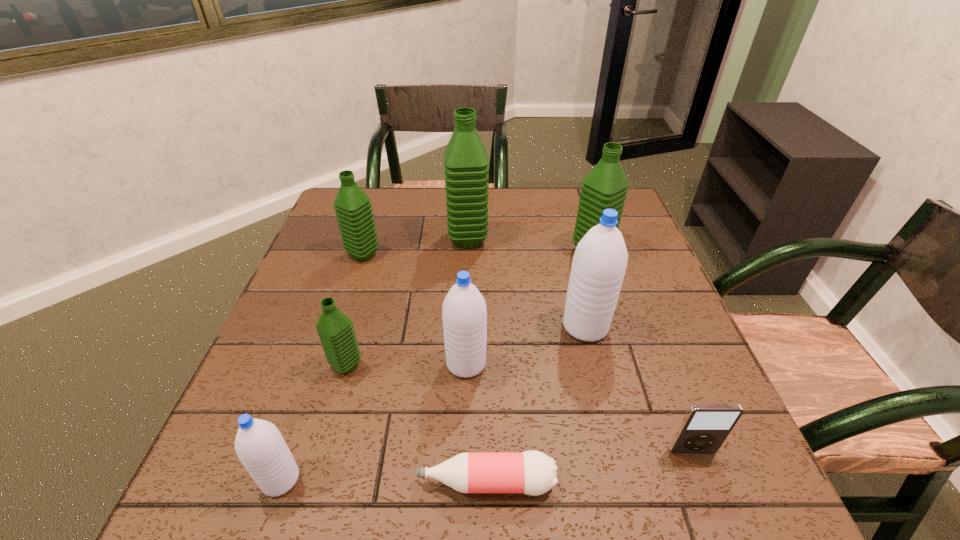
Where is `vacant space situated 0.310m on the back of the smallest green water bottle`? The image size is (960, 540). vacant space situated 0.310m on the back of the smallest green water bottle is located at coordinates (376, 260).

Locate an element on the screen. vacant space located on the back of the smallest blue water bottle is located at coordinates (324, 351).

This screenshot has height=540, width=960. What are the coordinates of `blank space located 0.100m on the front-facing side of the iPod` in the screenshot? It's located at (717, 516).

Locate an element on the screen. This screenshot has width=960, height=540. free location located with the cap open on the pink bottle is located at coordinates [x=308, y=482].

Where is `free space located 0.180m with the cap open on the pink bottle`? free space located 0.180m with the cap open on the pink bottle is located at coordinates (308, 482).

Identify the location of vacant position located with the cap open on the pink bottle. (333, 482).

The image size is (960, 540). Find the location of `object that is at the far edge`. object that is at the far edge is located at coordinates (466, 162).

Find the location of a particular element. The image size is (960, 540). water bottle present at the near edge is located at coordinates (260, 447).

You are a GUI agent. You are given a task and a screenshot of the screen. Output one action in this format:
    pyautogui.click(x=<x>, y=<y>)
    Task: Click on the bottle present at the near edge
    This screenshot has height=540, width=960.
    Given the screenshot: What is the action you would take?
    pyautogui.click(x=531, y=472)

The image size is (960, 540). Identify the location of water bottle that is positioned at the right edge. (605, 187).